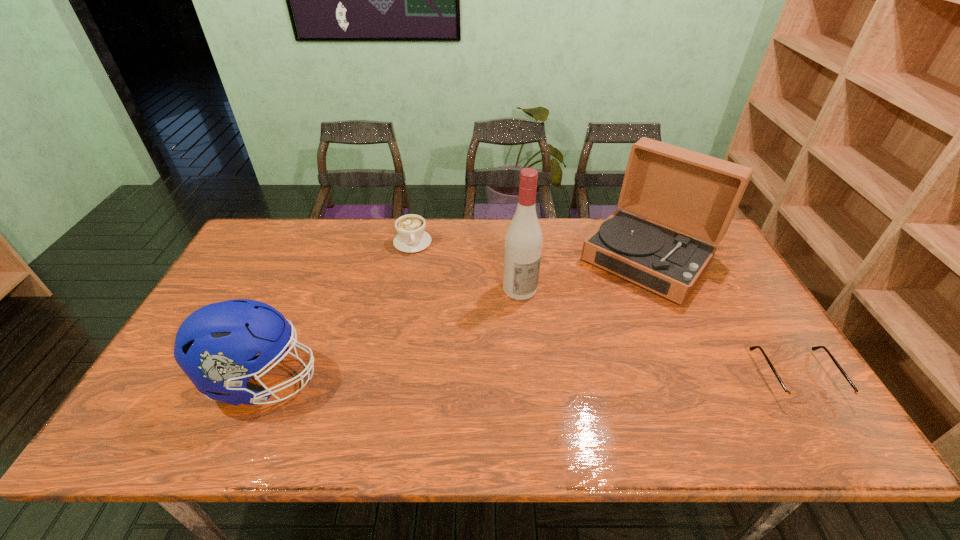
Identify the location of football helmet at the near edge. This screenshot has width=960, height=540. pyautogui.click(x=215, y=346).

Where is `spectacles located at the near edge`? spectacles located at the near edge is located at coordinates (791, 397).

Locate an element on the screen. The image size is (960, 540). object positioned at the left edge is located at coordinates (215, 346).

You are a GUI agent. You are given a task and a screenshot of the screen. Output one action in this format:
    pyautogui.click(x=<x>, y=<y>)
    Task: Click on the spectacles present at the right edge
    
    Given the screenshot: What is the action you would take?
    pyautogui.click(x=791, y=397)

The width and height of the screenshot is (960, 540). In order to click on phonograph record that is at the right edge in this screenshot , I will do `click(693, 193)`.

Locate an element on the screen. This screenshot has width=960, height=540. object positioned at the near left corner is located at coordinates (215, 346).

I want to click on object present at the far right corner, so click(x=693, y=193).

The width and height of the screenshot is (960, 540). Find the location of `object that is positioned at the near right corner`. object that is positioned at the near right corner is located at coordinates (791, 397).

I want to click on vacant space at the far edge, so click(x=577, y=260).

Image resolution: width=960 pixels, height=540 pixels. I want to click on blank space at the near edge of the desktop, so click(699, 396).